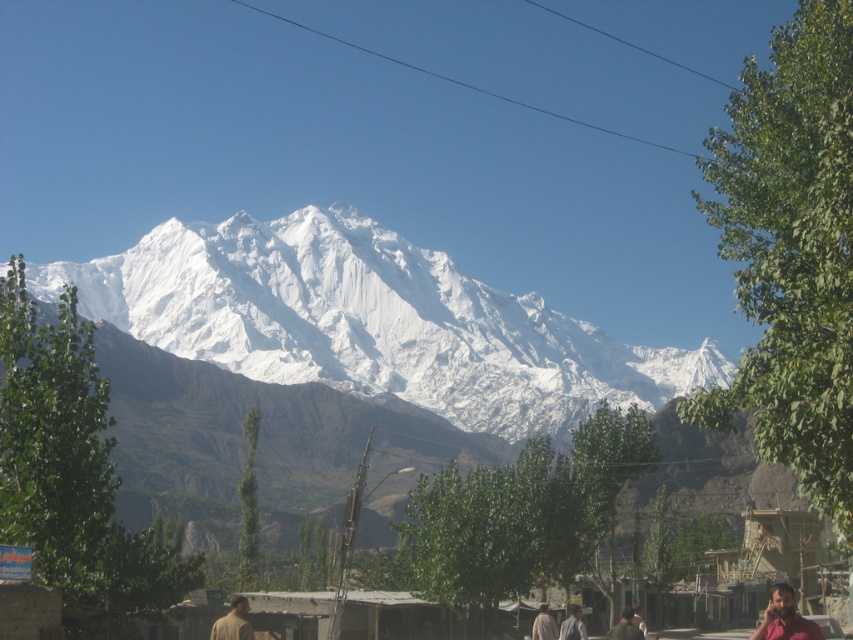
You are standing at the point marked by the coordinates point (572, 625) in the image. Looking around, you see the brown fabric shirt at lower center. Which direction should you face to see the snow covered mountain peaks in the distance?

The snow covered mountain peaks are in the distance behind you, so you should turn around and face away from the brown fabric shirt at lower center to see them.

Looking at this image, you are a photographer standing at the base of the mountain. You want to capture both the brown matte shirt at lower center and the brown fabric person at lower center in your photo. Which object should you focus on first to ensure both are in frame?

The brown matte shirt at lower center is larger than the brown fabric person at lower center. To ensure both are in frame, focus on the larger object first, which is the brown matte shirt at lower center, then adjust the camera to include the smaller one.